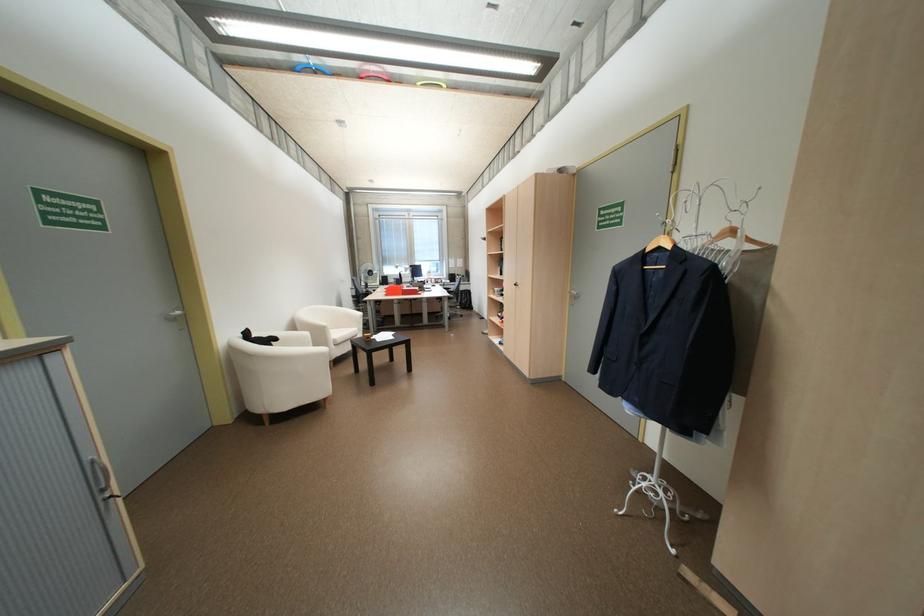
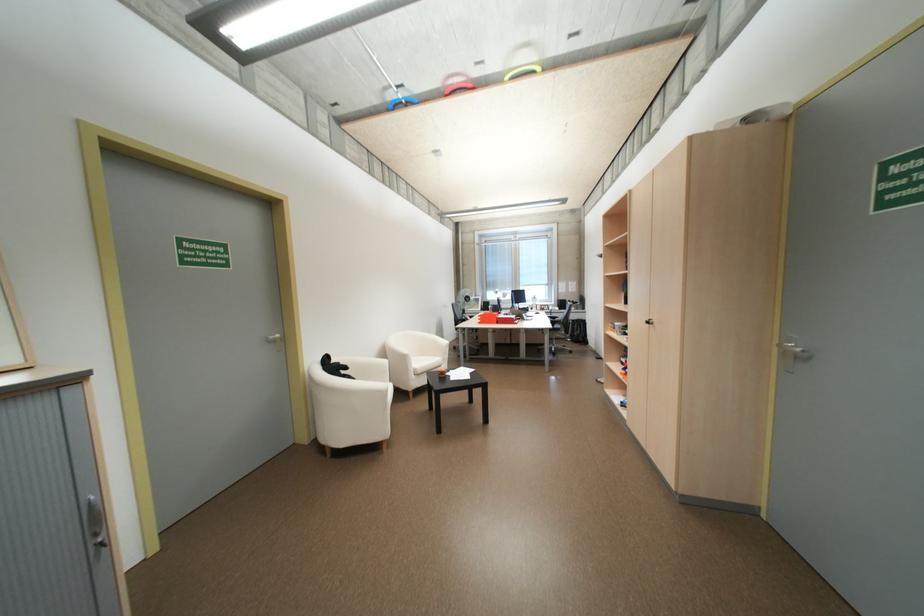
Where in the second image is the point corresponding to (x=344, y=339) from the first image?

(424, 369)